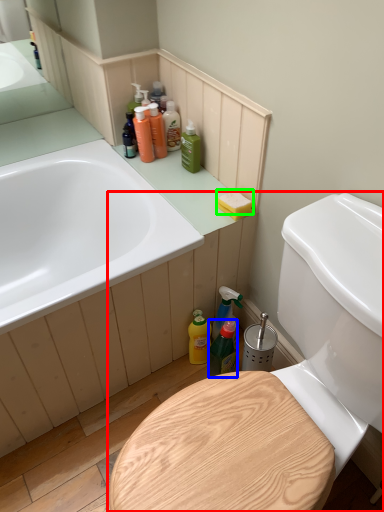
Question: Which object is positioned farthest from toilet (highlighted by a red box)? Select from bottle (highlighted by a blue box) and soap (highlighted by a green box).

Choices:
 (A) bottle
 (B) soap

Answer: (B)